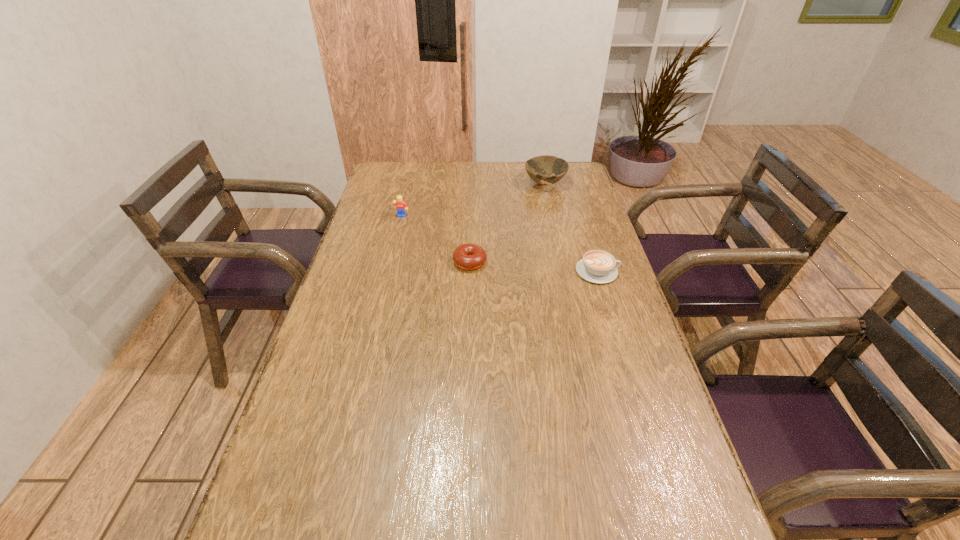
Locate an element on the screen. Image resolution: width=960 pixels, height=540 pixels. bowl situated at the right edge is located at coordinates (538, 168).

At what (x,y) coordinates should I click in order to perform the action: click on cappuccino situated at the right edge. Please return your answer as a coordinate pair (x, y). The width and height of the screenshot is (960, 540). Looking at the image, I should click on (597, 266).

Identify the location of object positioned at the far right corner. (538, 168).

In the image, there is a desktop. Identify the location of vacant area at the far edge. (522, 184).

You are a GUI agent. You are given a task and a screenshot of the screen. Output one action in this format:
    pyautogui.click(x=<x>, y=<y>)
    Task: Click on the vacant position at the left edge of the desktop
    This screenshot has width=960, height=540.
    Given the screenshot: What is the action you would take?
    pyautogui.click(x=377, y=191)

Locate an element on the screen. The height and width of the screenshot is (540, 960). vacant area at the right edge is located at coordinates (588, 288).

You are a GUI agent. You are given a task and a screenshot of the screen. Output one action in this format:
    pyautogui.click(x=<x>, y=<y>)
    Task: Click on the vacant space at the far left corner
    
    Given the screenshot: What is the action you would take?
    pyautogui.click(x=392, y=165)

You are a GUI agent. You are given a task and a screenshot of the screen. Output one action in this format:
    pyautogui.click(x=<x>, y=<y>)
    Task: Click on the blank region between the bowl and the cappuccino
    
    Given the screenshot: What is the action you would take?
    pyautogui.click(x=571, y=228)

Where is `blank region between the Lego and the third object from right to left`? blank region between the Lego and the third object from right to left is located at coordinates (436, 240).

What are the coordinates of `free spot between the bowl and the doughnut` in the screenshot? It's located at (507, 224).